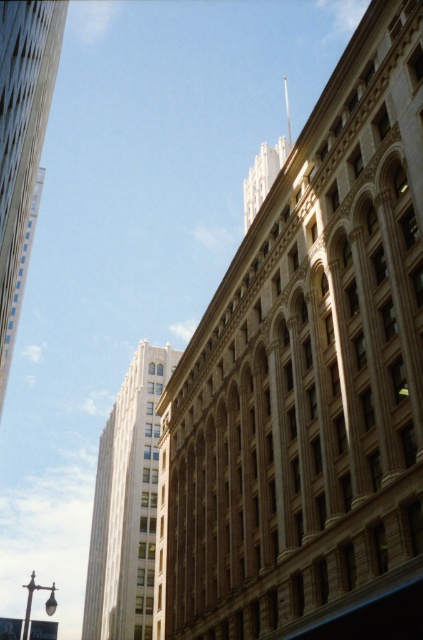
Is brown stone building at center wider than white marble tower at upper left?

No.

Between point (285, 438) and point (159, 385), which one is positioned behind?

The point (159, 385) is more distant.

The height and width of the screenshot is (640, 423). In order to click on brown stone building at center in this screenshot , I will do `click(310, 381)`.